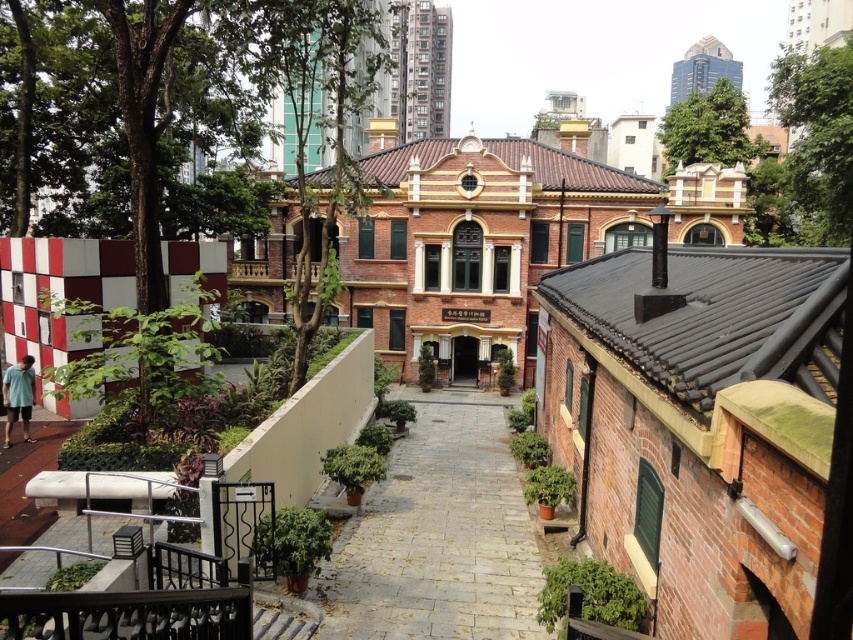
Question: Which of the following is the farthest from the observer?

Choices:
 (A) gray stone path at center
 (B) light blue cotton shirt at lower left

Answer: (B)

Question: Does gray stone path at center have a lesser width compared to light blue cotton shirt at lower left?

Choices:
 (A) no
 (B) yes

Answer: (A)

Question: Is gray stone path at center smaller than light blue cotton shirt at lower left?

Choices:
 (A) no
 (B) yes

Answer: (A)

Question: Among these objects, which one is nearest to the camera?

Choices:
 (A) light blue cotton shirt at lower left
 (B) gray stone path at center

Answer: (B)

Question: Is the position of gray stone path at center more distant than that of light blue cotton shirt at lower left?

Choices:
 (A) no
 (B) yes

Answer: (A)